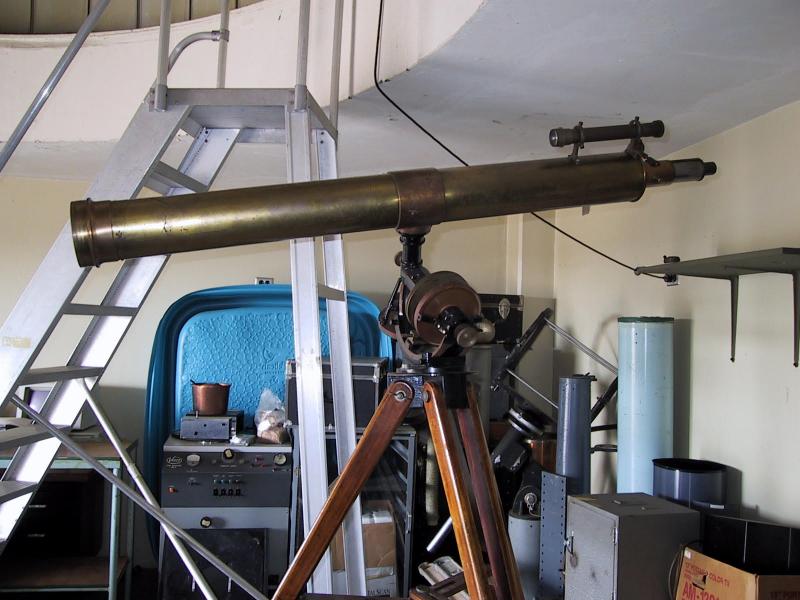
At what (x,y) coordinates should I click in order to perform the action: click on top of ladder stairs. Please return your answer as a coordinate pair (x, y). Looking at the image, I should click on tap(240, 96).